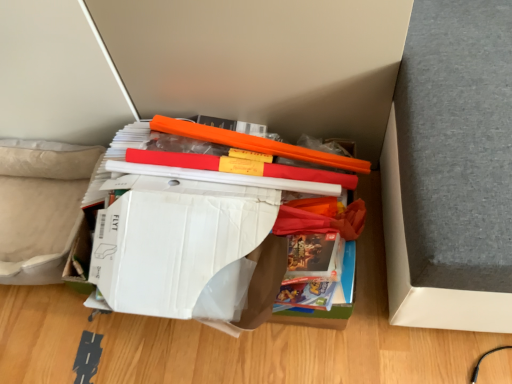
Question: From a real-world perspective, is orange plastic ruler at center physically below white cardboard box at center, which ranks as the second paperback book in front-to-back order?

Choices:
 (A) yes
 (B) no

Answer: (B)

Question: From a real-world perspective, is orange plastic ruler at center located higher than white cardboard box at center, which ranks as the second paperback book in front-to-back order?

Choices:
 (A) yes
 (B) no

Answer: (A)

Question: Is orange plastic ruler at center next to white cardboard box at center, which is counted as the 1th paperback book, starting from the back?

Choices:
 (A) yes
 (B) no

Answer: (B)

Question: Is the position of orange plastic ruler at center more distant than that of white cardboard box at center, which ranks as the second paperback book in front-to-back order?

Choices:
 (A) no
 (B) yes

Answer: (B)

Question: From the image's perspective, is orange plastic ruler at center located beneath white cardboard box at center, which ranks as the second paperback book in front-to-back order?

Choices:
 (A) no
 (B) yes

Answer: (A)

Question: Is the position of orange plastic ruler at center less distant than that of white cardboard box at center, which ranks as the second paperback book in front-to-back order?

Choices:
 (A) no
 (B) yes

Answer: (A)

Question: Does white cardboard box at center, which is counted as the 1th paperback book, starting from the back, contain white cardboard box at center, positioned as the first paperback book in front-to-back order?

Choices:
 (A) yes
 (B) no

Answer: (A)

Question: Is white cardboard box at center, which is counted as the 1th paperback book, starting from the back, taller than white cardboard box at center, which ranks as the second paperback book in back-to-front order?

Choices:
 (A) yes
 (B) no

Answer: (A)

Question: Is white cardboard box at center, which is counted as the 1th paperback book, starting from the back, not close to white cardboard box at center, which ranks as the second paperback book in back-to-front order?

Choices:
 (A) yes
 (B) no

Answer: (B)

Question: From a real-world perspective, is white cardboard box at center, which is counted as the 1th paperback book, starting from the back, located higher than white cardboard box at center, positioned as the first paperback book in front-to-back order?

Choices:
 (A) no
 (B) yes

Answer: (A)

Question: From the image's perspective, is white cardboard box at center, which is counted as the 1th paperback book, starting from the back, located beneath white cardboard box at center, which ranks as the second paperback book in back-to-front order?

Choices:
 (A) yes
 (B) no

Answer: (B)

Question: Is the depth of white cardboard box at center, which ranks as the second paperback book in front-to-back order, greater than that of white cardboard box at center, which ranks as the second paperback book in back-to-front order?

Choices:
 (A) no
 (B) yes

Answer: (B)

Question: From the image's perspective, is white cardboard box at center, which is counted as the 1th paperback book, starting from the back, over orange plastic ruler at center?

Choices:
 (A) yes
 (B) no

Answer: (B)